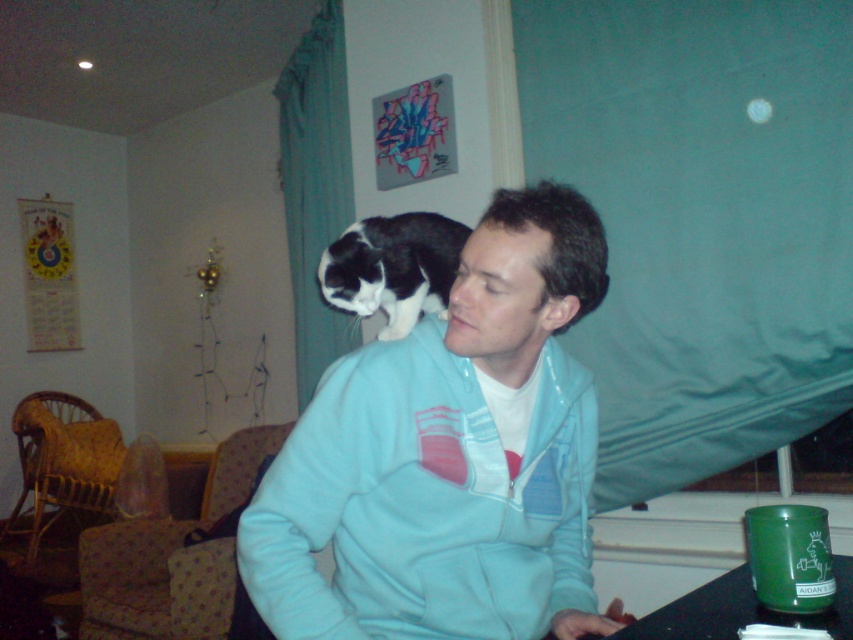
Does point (503, 593) lie behind point (529, 202)?

Yes, it is.

Image resolution: width=853 pixels, height=640 pixels. I want to click on light blue fleece at center, so click(x=450, y=456).

Which is behind, point (523, 588) or point (432, 221)?

Point (432, 221)

Locate an element on the screen. Image resolution: width=853 pixels, height=640 pixels. light blue fleece at center is located at coordinates (450, 456).

Is point (590, 404) more distant than point (396, 336)?

No, (590, 404) is closer to viewer.

The image size is (853, 640). What are the coordinates of `light blue fleece at center` in the screenshot? It's located at (450, 456).

The height and width of the screenshot is (640, 853). Describe the element at coordinates (525, 275) in the screenshot. I see `matte blue sweatshirt at center` at that location.

Can you confirm if matte blue sweatshirt at center is bigger than black and white fur cat on shoulder?

Incorrect, matte blue sweatshirt at center is not larger than black and white fur cat on shoulder.

Does point (488, 221) come behind point (416, 257)?

No.

The image size is (853, 640). What are the coordinates of `matte blue sweatshirt at center` in the screenshot? It's located at (525, 275).